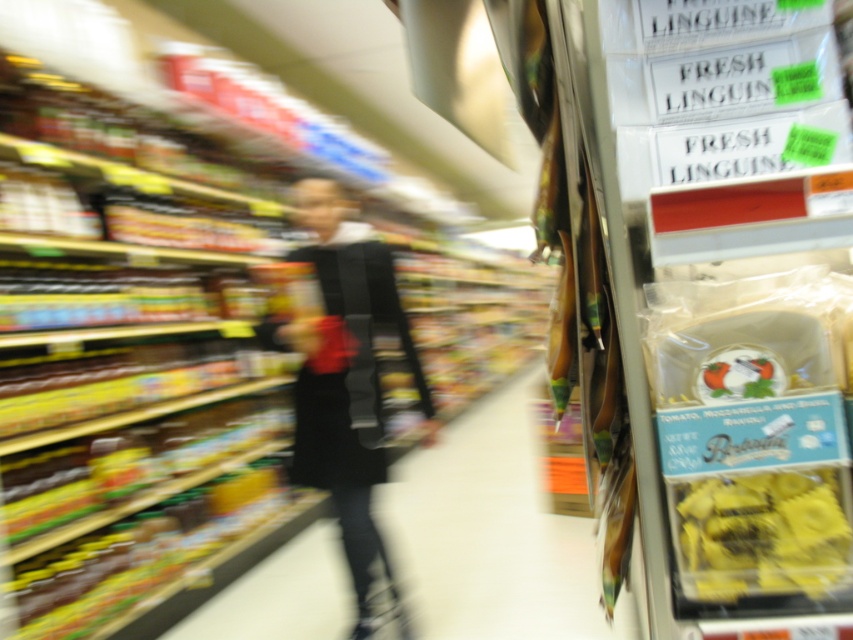
Question: Is matte black bag at center to the right of yellow matte pasta at right from the viewer's perspective?

Choices:
 (A) yes
 (B) no

Answer: (B)

Question: Estimate the real-world distances between objects in this image. Which object is closer to the matte black bag at center?

Choices:
 (A) yellow matte pasta at right
 (B) black fabric at center

Answer: (B)

Question: Which of the following is the farthest from the observer?

Choices:
 (A) matte black bag at center
 (B) yellow matte pasta at right

Answer: (A)

Question: Does matte black bag at center have a smaller size compared to black fabric at center?

Choices:
 (A) yes
 (B) no

Answer: (B)

Question: Estimate the real-world distances between objects in this image. Which object is farther from the matte black bag at center?

Choices:
 (A) black fabric at center
 (B) yellow matte pasta at right

Answer: (B)

Question: Is matte black bag at center smaller than black fabric at center?

Choices:
 (A) no
 (B) yes

Answer: (A)